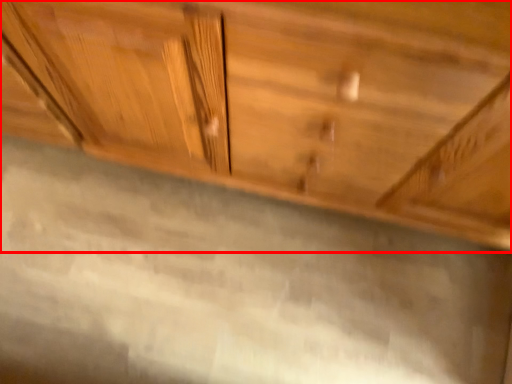
Question: From the image's perspective, where is cabinetry (annotated by the red box) located relative to granite?

Choices:
 (A) below
 (B) above

Answer: (B)